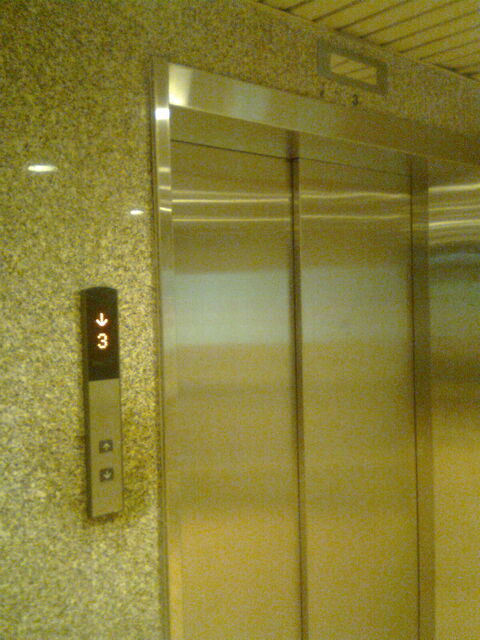
This screenshot has width=480, height=640. What are the coordinates of `elevator` in the screenshot? It's located at (274, 392).